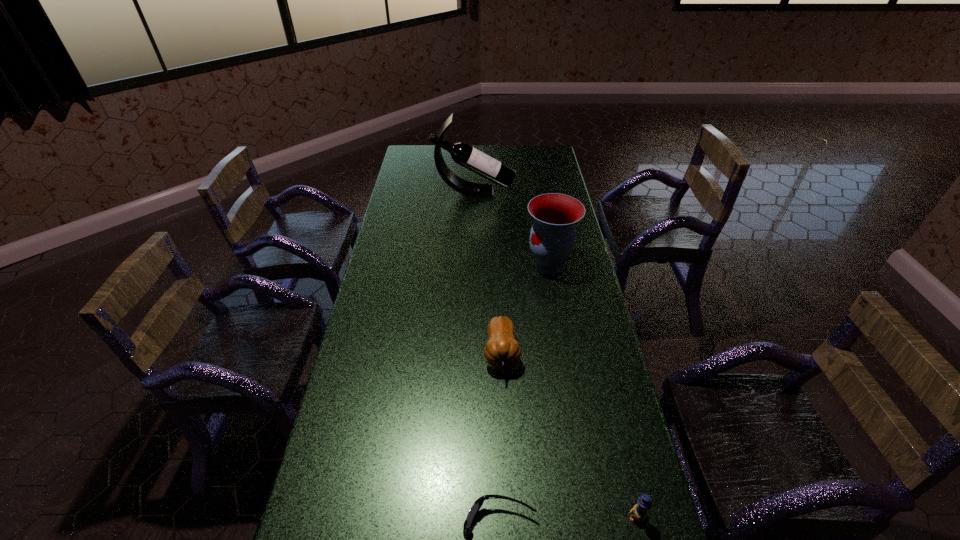
Where is `duckling that is at the right edge`? This screenshot has width=960, height=540. duckling that is at the right edge is located at coordinates (639, 512).

In the image, there is a desktop. Where is `free region at the left edge`? The height and width of the screenshot is (540, 960). free region at the left edge is located at coordinates (389, 272).

In order to click on vacant space at the right edge of the desktop in this screenshot , I will do `click(581, 447)`.

Where is `free space between the wine bottle and the third farthest object`? The width and height of the screenshot is (960, 540). free space between the wine bottle and the third farthest object is located at coordinates (488, 273).

Image resolution: width=960 pixels, height=540 pixels. Find the location of `free space that is in between the second shortest object and the farthest object`. free space that is in between the second shortest object and the farthest object is located at coordinates (555, 354).

The image size is (960, 540). What are the coordinates of `empty space between the second shortest object and the tallest object` in the screenshot? It's located at (555, 354).

The image size is (960, 540). I want to click on empty space that is in between the duckling and the tallest object, so click(x=555, y=354).

The height and width of the screenshot is (540, 960). What are the coordinates of `free space between the third farthest object and the second shortest object` in the screenshot? It's located at (568, 435).

You are a GUI agent. You are given a task and a screenshot of the screen. Output one action in this format:
    pyautogui.click(x=<x>, y=<y>)
    Task: Click on the free space between the gourd and the second shortest object
    This screenshot has width=960, height=540.
    Given the screenshot: What is the action you would take?
    pyautogui.click(x=568, y=435)

I want to click on free space between the wine bottle and the fourth shortest object, so click(512, 229).